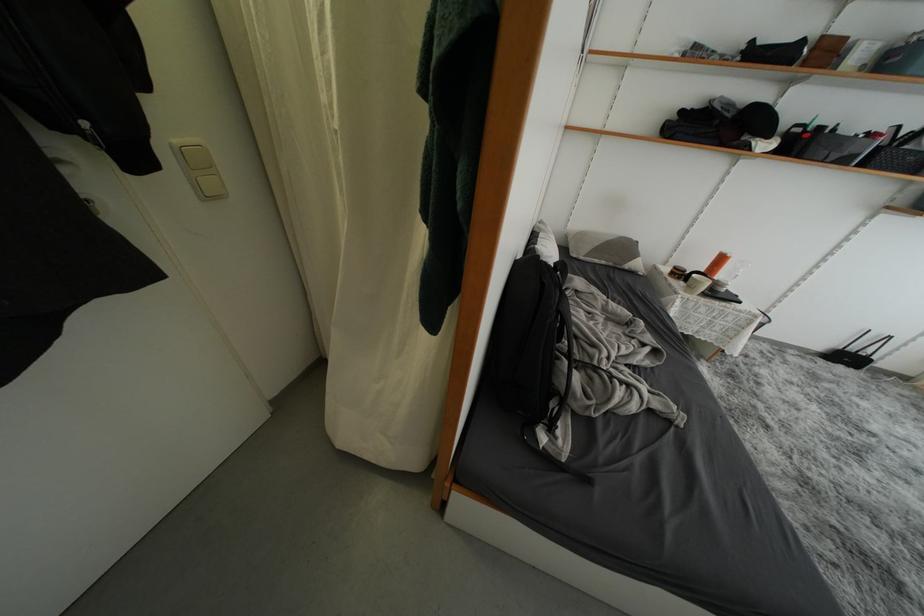
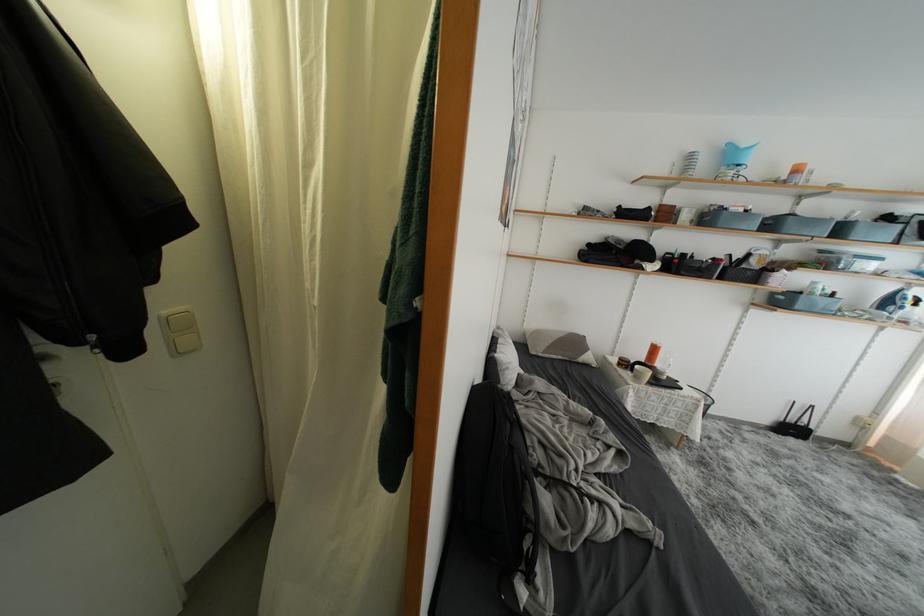
Find the pixel in the second image that matches the point at 854,362 in the first image.

(797, 434)